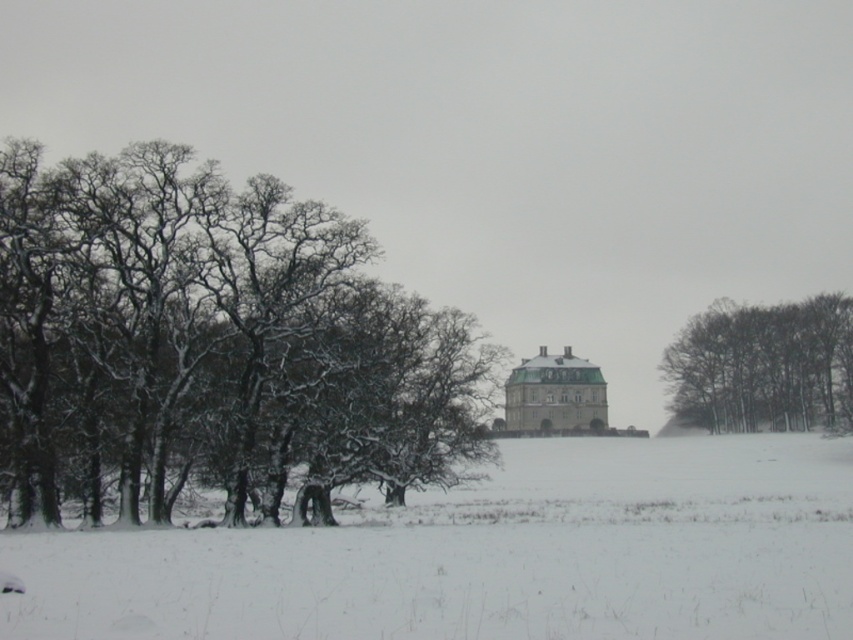
Question: Can you confirm if white fluffy snow at lower center is smaller than dark brown textured tree at right?

Choices:
 (A) no
 (B) yes

Answer: (A)

Question: Which point is closer to the camera taking this photo?

Choices:
 (A) (346, 368)
 (B) (737, 422)

Answer: (A)

Question: Can you confirm if snow-covered bark trees at left is positioned below white fluffy snow at lower center?

Choices:
 (A) yes
 (B) no

Answer: (B)

Question: Which point appears closest to the camera in this image?

Choices:
 (A) (595, 465)
 (B) (851, 422)

Answer: (A)

Question: Observing the image, what is the correct spatial positioning of snow-covered bark trees at left in reference to white fluffy snow at lower center?

Choices:
 (A) right
 (B) left

Answer: (B)

Question: Among these points, which one is nearest to the camera?

Choices:
 (A) (392, 401)
 (B) (809, 328)

Answer: (A)